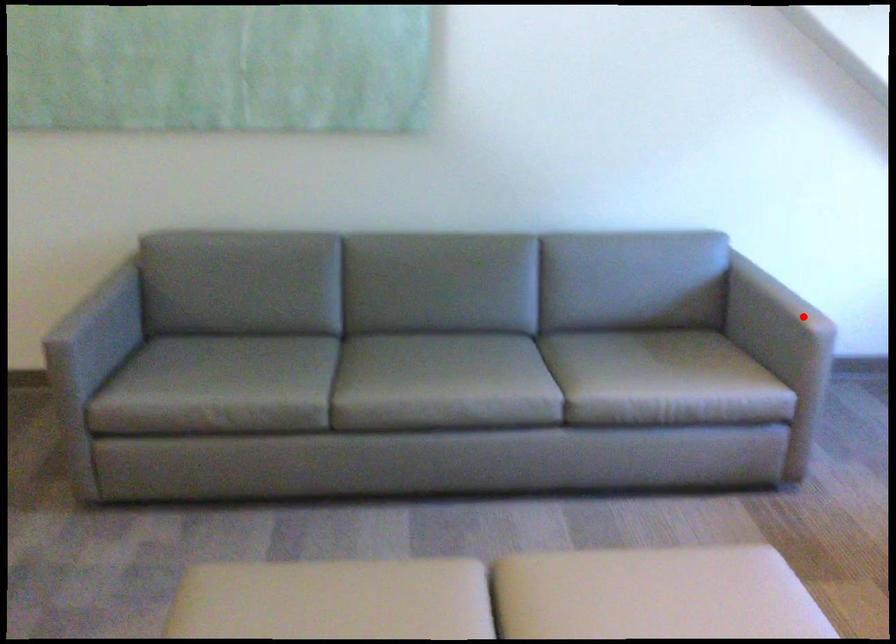
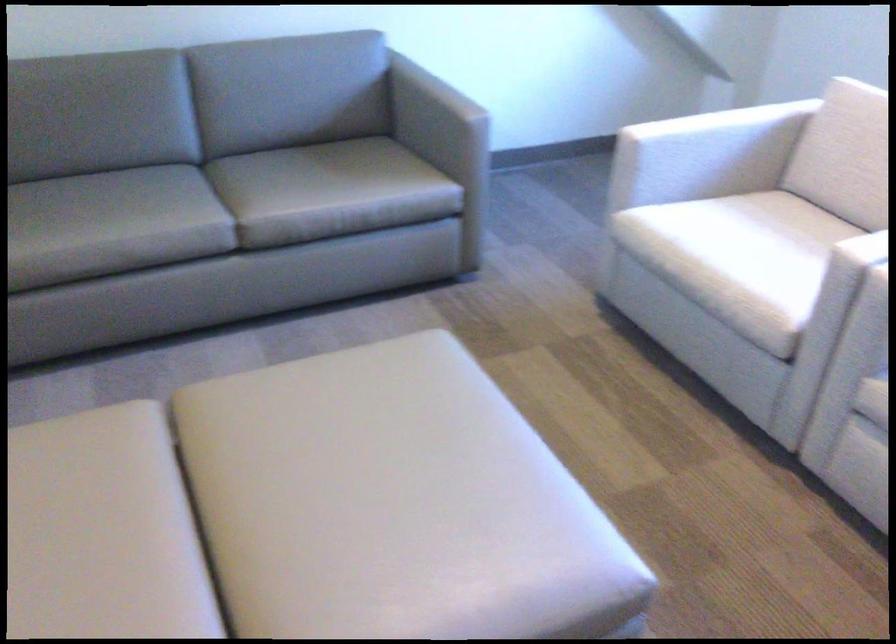
In the second image, find the point that corresponds to the highlighted location in the first image.

(457, 104)